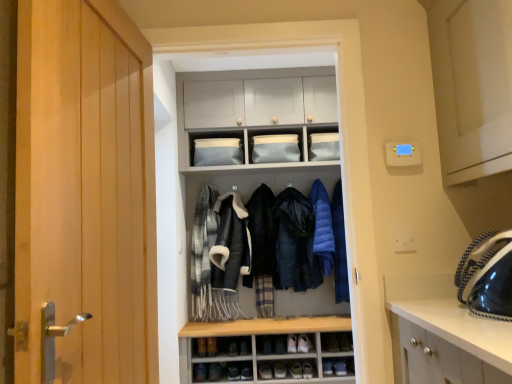
Question: Does plaid wool scarf at center, the first clothing viewed from the left, appear on the right side of leather shoe at lower center, acting as the second shoe starting from the top?

Choices:
 (A) yes
 (B) no

Answer: (B)

Question: Is leather shoe at lower center, the 3th shoe positioned from the left, located within plaid wool scarf at center, the first clothing viewed from the left?

Choices:
 (A) yes
 (B) no

Answer: (B)

Question: Considering the relative sizes of plaid wool scarf at center, the first clothing viewed from the left, and leather shoe at lower center, the 3th shoe positioned from the left, in the image provided, is plaid wool scarf at center, the first clothing viewed from the left, thinner than leather shoe at lower center, the 3th shoe positioned from the left,?

Choices:
 (A) yes
 (B) no

Answer: (B)

Question: Considering the relative sizes of plaid wool scarf at center, the first clothing viewed from the left, and leather shoe at lower center, acting as the second shoe starting from the top, in the image provided, is plaid wool scarf at center, the first clothing viewed from the left, taller than leather shoe at lower center, acting as the second shoe starting from the top,?

Choices:
 (A) yes
 (B) no

Answer: (A)

Question: Does plaid wool scarf at center, the first clothing viewed from the left, have a smaller size compared to leather shoe at lower center, acting as the second shoe starting from the bottom?

Choices:
 (A) yes
 (B) no

Answer: (B)

Question: Does point (322, 148) appear closer or farther from the camera than point (193, 230)?

Choices:
 (A) closer
 (B) farther

Answer: (A)

Question: Looking at the image, does matte gray cabinet at upper center, which is the 1th cabinet in right-to-left order, seem bigger or smaller compared to plaid wool scarf at center, which is the 5th clothing from right to left?

Choices:
 (A) small
 (B) big

Answer: (A)

Question: Based on their positions, is matte gray cabinet at upper center, the 3th cabinet when ordered from left to right, located to the left or right of plaid wool scarf at center, which is the 5th clothing from right to left?

Choices:
 (A) left
 (B) right

Answer: (B)

Question: From their relative heights in the image, would you say matte gray cabinet at upper center, the 3th cabinet when ordered from left to right, is taller or shorter than plaid wool scarf at center, which is the 5th clothing from right to left?

Choices:
 (A) tall
 (B) short

Answer: (B)

Question: From a real-world perspective, is blue down jacket at center, the 1th clothing from the right, positioned above or below matte gray fabric at upper center, acting as the second cabinet starting from the right?

Choices:
 (A) above
 (B) below

Answer: (B)

Question: Is point (334, 284) closer or farther from the camera than point (262, 157)?

Choices:
 (A) closer
 (B) farther

Answer: (B)

Question: Is blue down jacket at center, the 5th clothing when ordered from left to right, in front of or behind matte gray fabric at upper center, acting as the second cabinet starting from the right, in the image?

Choices:
 (A) front
 (B) behind

Answer: (A)

Question: In terms of size, does blue down jacket at center, the 1th clothing from the right, appear bigger or smaller than matte gray fabric at upper center, which is the second cabinet from left to right?

Choices:
 (A) small
 (B) big

Answer: (B)

Question: In terms of size, does dark blue down jacket at center, which is the 3th clothing in right-to-left order, appear bigger or smaller than leather shoe at lower center, acting as the second shoe starting from the bottom?

Choices:
 (A) big
 (B) small

Answer: (A)

Question: Visually, is dark blue down jacket at center, placed as the third clothing when sorted from left to right, positioned to the left or to the right of leather shoe at lower center, acting as the second shoe starting from the bottom?

Choices:
 (A) right
 (B) left

Answer: (A)